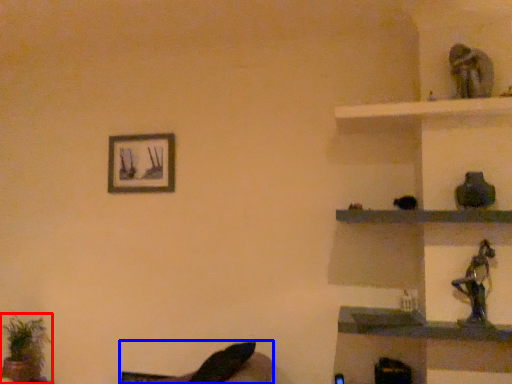
Question: Which of the following is the farthest to the observer, houseplant (highlighted by a red box) or swivel chair (highlighted by a blue box)?

Choices:
 (A) houseplant
 (B) swivel chair

Answer: (A)